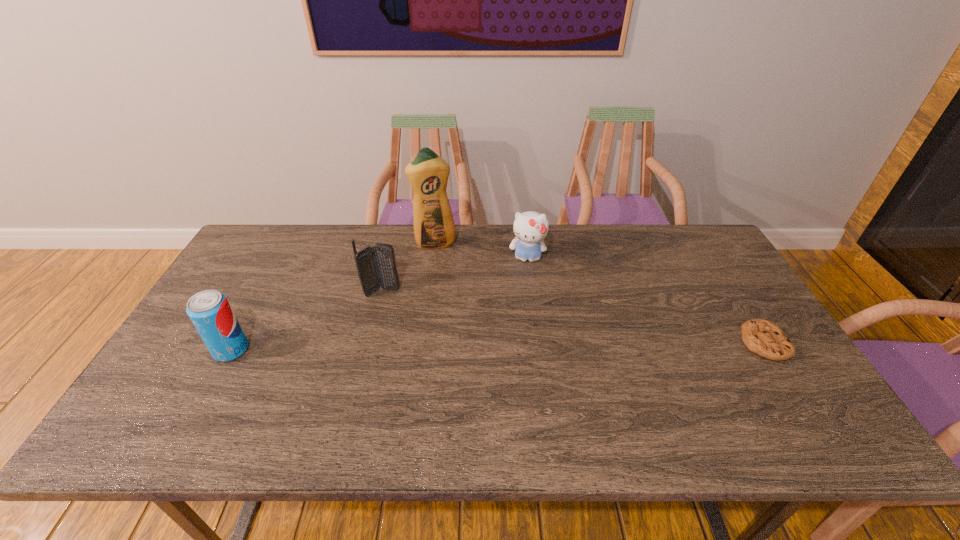
Locate an element on the screen. The height and width of the screenshot is (540, 960). free space that satisfies the following two spatial constraints: 1. on the front side of the third farthest object; 2. on the left side of the cookie is located at coordinates (370, 343).